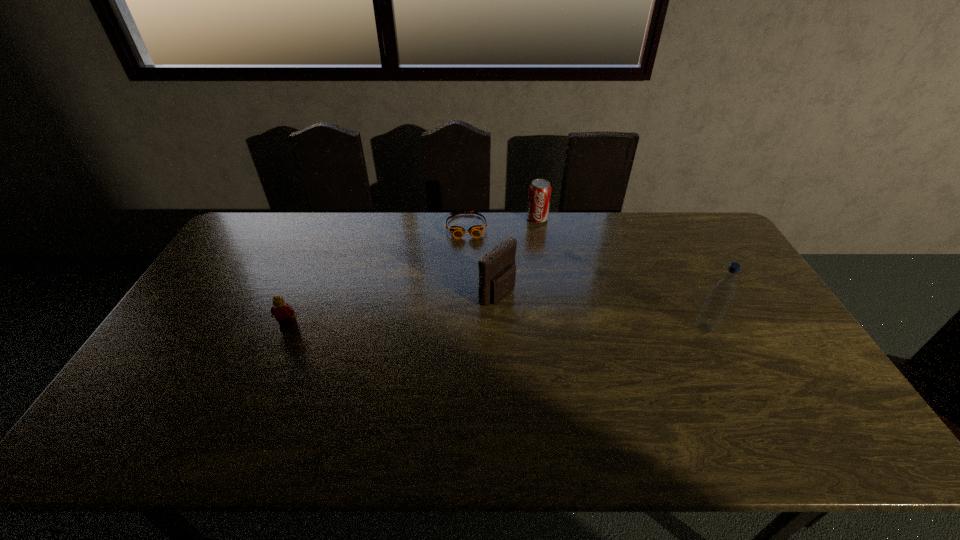
The image size is (960, 540). I want to click on soda can that is at the far edge, so click(x=540, y=190).

At what (x,y) coordinates should I click in order to perform the action: click on blank space at the far edge of the desktop. Please return your answer as a coordinate pair (x, y). This screenshot has width=960, height=540. Looking at the image, I should click on (575, 221).

The width and height of the screenshot is (960, 540). In the image, there is a desktop. Identify the location of free space at the near edge. (624, 397).

Locate an element on the screen. vacant space at the left edge of the desktop is located at coordinates (224, 290).

Where is `free spot at the right edge of the desktop`? The height and width of the screenshot is (540, 960). free spot at the right edge of the desktop is located at coordinates (772, 318).

At what (x,y) coordinates should I click in order to perform the action: click on vacant space at the far left corner of the desktop. Please return your answer as a coordinate pair (x, y). Image resolution: width=960 pixels, height=540 pixels. Looking at the image, I should click on (273, 223).

Image resolution: width=960 pixels, height=540 pixels. I want to click on vacant area at the near left corner of the desktop, so click(129, 407).

Locate an element on the screen. This screenshot has height=540, width=960. vacant point at the far right corner is located at coordinates (714, 242).

You are a GUI agent. You are given a task and a screenshot of the screen. Output one action in this format:
    pyautogui.click(x=<x>, y=<y>)
    Task: Click on the vacant space at the near right corner of the desktop
    
    Given the screenshot: What is the action you would take?
    pyautogui.click(x=811, y=392)

I want to click on vacant space that is in between the third tallest object and the fourth tallest object, so click(413, 272).